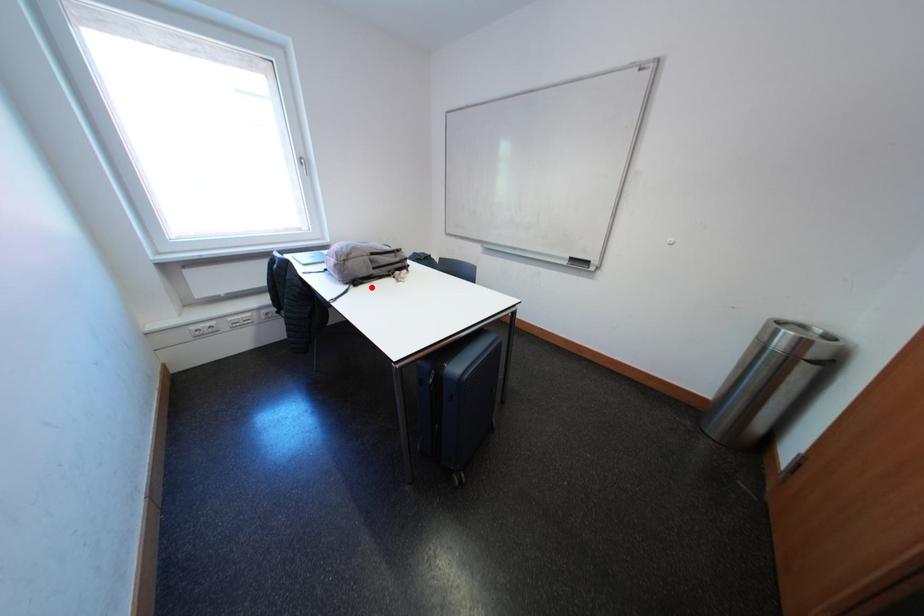
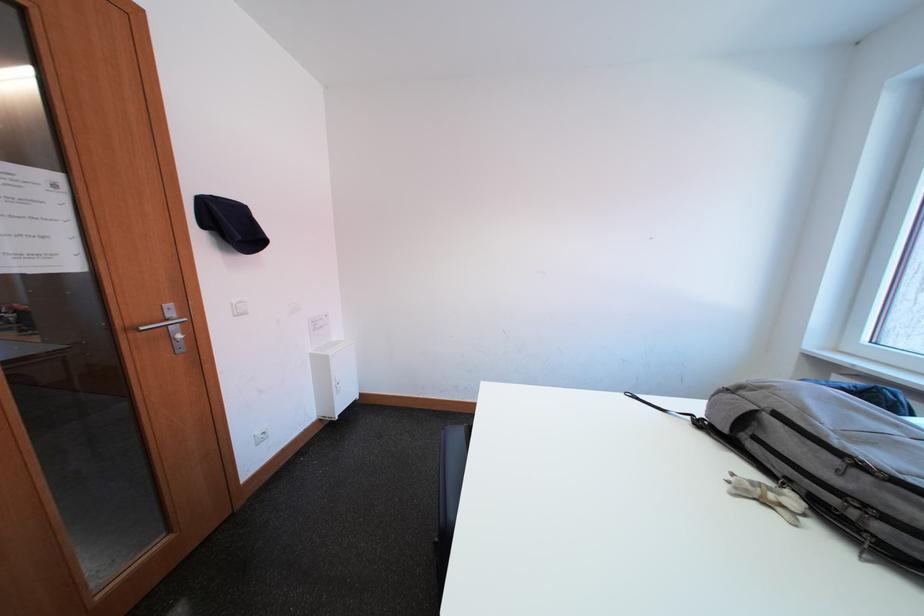
Where in the second image is the point corresponding to the highlighted location from the first image?

(719, 438)